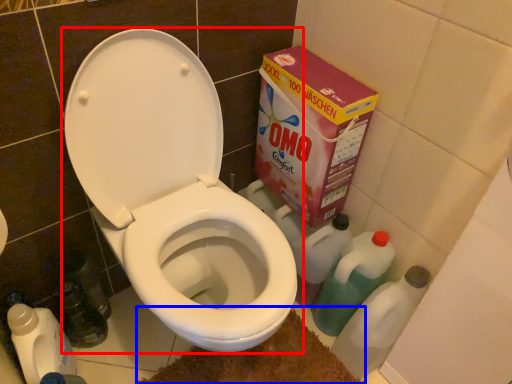
Question: Which object appears closest to the camera in this image, toilet (highlighted by a red box) or bath mat (highlighted by a blue box)?

Choices:
 (A) toilet
 (B) bath mat

Answer: (A)